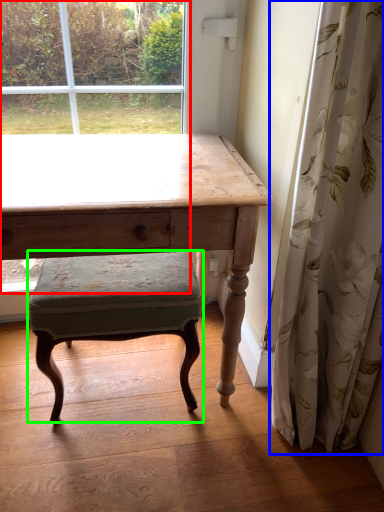
Question: Which object is positioned farthest from bay window (highlighted by a red box)? Select from curtain (highlighted by a blue box) and stool (highlighted by a green box).

Choices:
 (A) curtain
 (B) stool

Answer: (A)